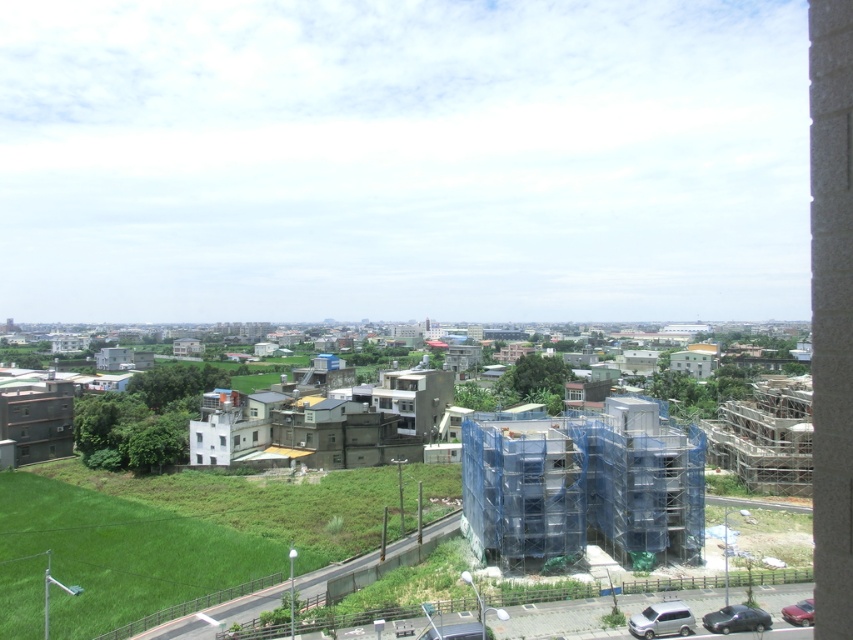
Question: Which of the following is the farthest from the observer?

Choices:
 (A) shiny black car at lower right
 (B) satin silver suv at lower right
 (C) metallic silver car at lower right

Answer: (C)

Question: Which point is closer to the camera?

Choices:
 (A) (712, 627)
 (B) (664, 602)
 (C) (788, 609)

Answer: (A)

Question: Which of the following is the closest to the observer?

Choices:
 (A) (676, 628)
 (B) (755, 616)
 (C) (461, 480)

Answer: (A)

Question: Is satin silver suv at lower right closer to camera compared to shiny black car at lower right?

Choices:
 (A) no
 (B) yes

Answer: (A)

Question: Can you confirm if blue mesh scaffolding at center is positioned below shiny black car at lower right?

Choices:
 (A) yes
 (B) no

Answer: (B)

Question: Can you confirm if concrete block wall at right is positioned below shiny black car at lower right?

Choices:
 (A) no
 (B) yes

Answer: (A)